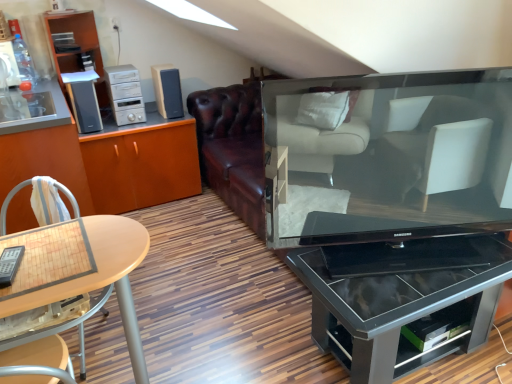
You are a GUI agent. You are given a task and a screenshot of the screen. Output one action in this format:
    pyautogui.click(x=<x>, y=<y>)
    Task: Click on the free space above satin black speaker at upper left, arranged as the second appliance when viewed from the right (from a real-world perspective)
    
    Given the screenshot: What is the action you would take?
    pyautogui.click(x=79, y=78)